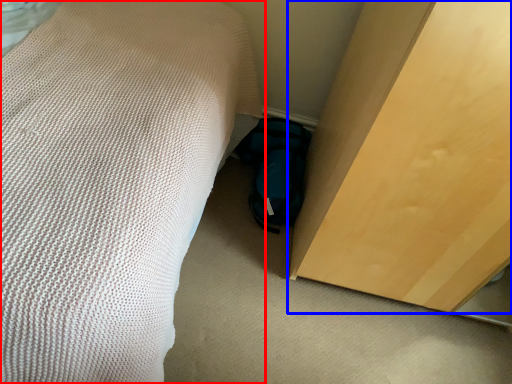
Question: Which of the following is the farthest to the observer, bed (highlighted by a red box) or furniture (highlighted by a blue box)?

Choices:
 (A) bed
 (B) furniture

Answer: (B)